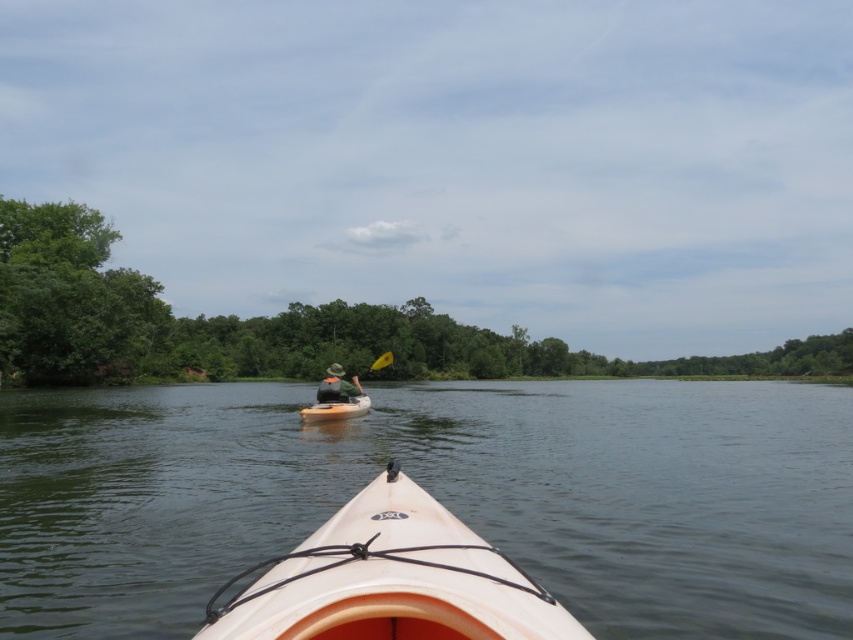
Question: Considering the real-world distances, which object is closest to the white plastic kayak at center?

Choices:
 (A) white matte kayak at center
 (B) orange plastic canoe at center

Answer: (B)

Question: Is white matte kayak at center thinner than orange plastic canoe at center?

Choices:
 (A) no
 (B) yes

Answer: (A)

Question: Is white matte kayak at center smaller than green fabric hat at center?

Choices:
 (A) yes
 (B) no

Answer: (B)

Question: Does white matte kayak at center appear under green fabric hat at center?

Choices:
 (A) no
 (B) yes

Answer: (A)

Question: Which is nearer to the green fabric hat at center?

Choices:
 (A) green leafy trees at left
 (B) white matte kayak at center
 (C) orange plastic canoe at center

Answer: (C)

Question: Which is nearer to the green fabric hat at center?

Choices:
 (A) white matte kayak at center
 (B) green leafy trees at center

Answer: (A)